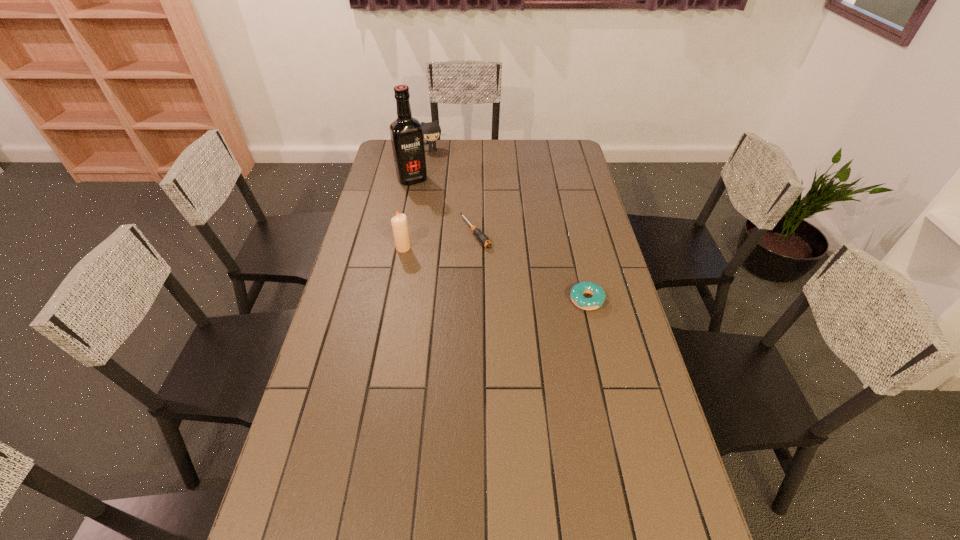
Identify the location of free space at the far right corner. This screenshot has width=960, height=540. (565, 166).

Image resolution: width=960 pixels, height=540 pixels. I want to click on vacant space at the near right corner of the desktop, so click(648, 502).

Locate an element on the screen. vacant space that's between the tallest object and the candle is located at coordinates (408, 214).

Find the location of a particular element. free spot between the tallest object and the candle is located at coordinates (408, 214).

You are a GUI agent. You are given a task and a screenshot of the screen. Output one action in this format:
    pyautogui.click(x=<x>, y=<y>)
    Task: Click on the free space between the screwdriver and the liquor
    This screenshot has height=540, width=960.
    Given the screenshot: What is the action you would take?
    pyautogui.click(x=444, y=206)

The height and width of the screenshot is (540, 960). I want to click on blank region between the third shortest object and the candle, so click(x=419, y=199).

This screenshot has height=540, width=960. I want to click on free point between the second tallest object and the doughnut, so click(494, 274).

Locate an element on the screen. unoccupied area between the fourth nearest object and the nearest object is located at coordinates (499, 240).

The image size is (960, 540). Find the location of `free space between the fourth object from left to right and the candle`. free space between the fourth object from left to right and the candle is located at coordinates (440, 240).

Where is `vacant space that is in between the fourth shortest object and the liquor`? The image size is (960, 540). vacant space that is in between the fourth shortest object and the liquor is located at coordinates (408, 214).